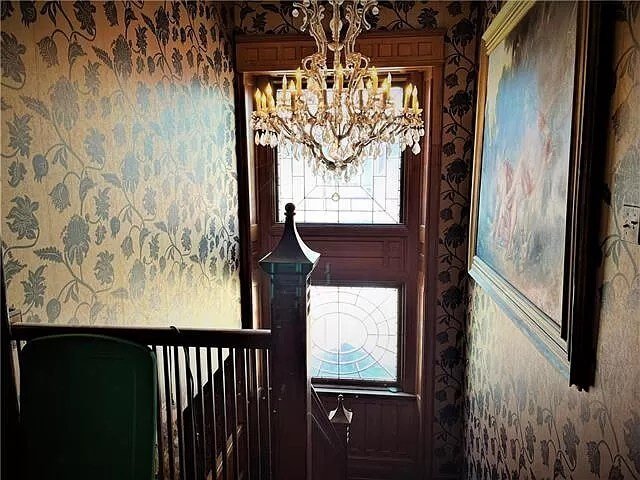
You are a GUI agent. You are given a task and a screenshot of the screen. Output one action in this format:
    pyautogui.click(x=<x>, y=<y>)
    Task: Click on the newel cap
    Image resolution: width=640 pixels, height=480 pixels.
    Given the screenshot: What is the action you would take?
    pyautogui.click(x=287, y=224), pyautogui.click(x=340, y=411)